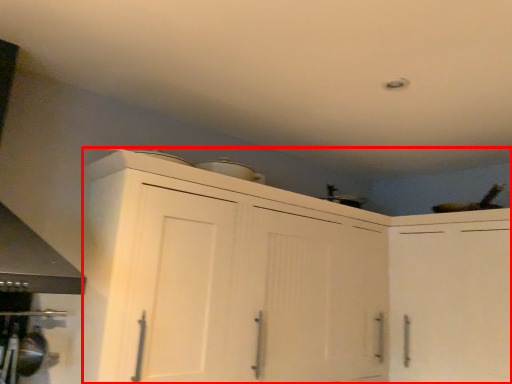
Question: From the image's perspective, what is the correct spatial positioning of cabinetry (annotated by the red box) in reference to cabinetry?

Choices:
 (A) below
 (B) above

Answer: (B)